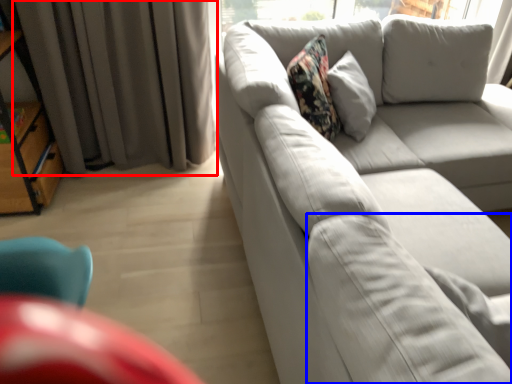
Question: Which object appears farthest to the camera in this image, curtain (highlighted by a red box) or pillow (highlighted by a blue box)?

Choices:
 (A) curtain
 (B) pillow

Answer: (A)